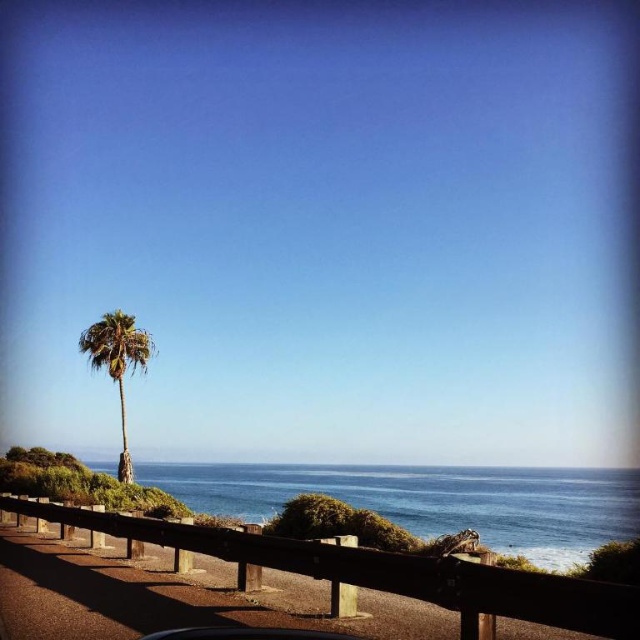
You are a hiker standing at point (280, 541) and want to reach point (522, 544). Given that the guardrail is along the road, which direction should you walk along the guardrail to reach your destination?

You should walk north along the guardrail to reach point (522, 544) from point (280, 541) since the point (522, 544) is behind point (280, 541).

You are standing at the lower edge of the image. Looking towards the scene, where is the brown wooden railing at lower center located in terms of its 2D coordinates?

The brown wooden railing at lower center is located at the 2D coordinates of point (384, 570).